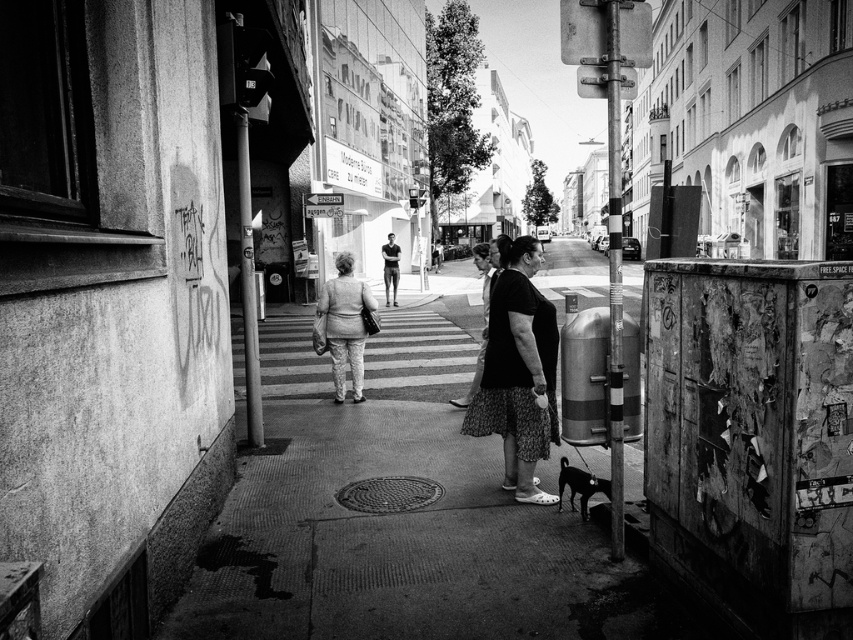
Based on the photo, who is shorter, black textured dress at center or light gray fabric jacket at center?

Standing shorter between the two is light gray fabric jacket at center.

Does black textured dress at center appear under light gray fabric jacket at center?

Incorrect, black textured dress at center is not positioned below light gray fabric jacket at center.

Does point (508, 250) come closer to viewer compared to point (357, 324)?

Yes, point (508, 250) is in front of point (357, 324).

The image size is (853, 640). I want to click on black textured dress at center, so click(518, 371).